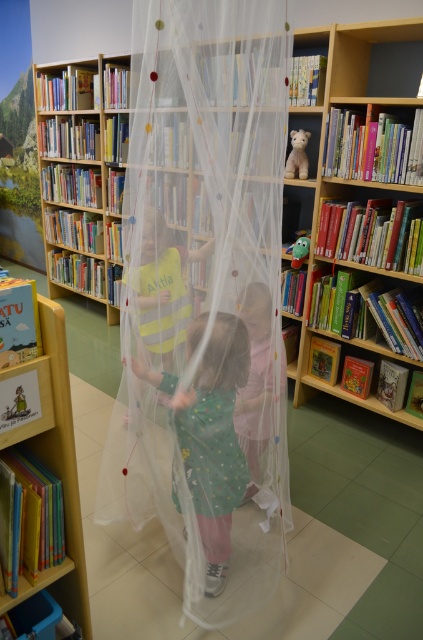
Which of these two, polka dot fabric dress at center or pastel polka dot dress at center, stands taller?

With more height is polka dot fabric dress at center.

This screenshot has width=423, height=640. What are the coordinates of `polka dot fabric dress at center` in the screenshot? It's located at (211, 436).

This screenshot has height=640, width=423. I want to click on polka dot fabric dress at center, so click(x=211, y=436).

Who is shorter, wooden bookshelf at right or green plush toy at upper center?

green plush toy at upper center

Consider the image. Is wooden bookshelf at right to the left of green plush toy at upper center from the viewer's perspective?

No, wooden bookshelf at right is not to the left of green plush toy at upper center.

Does point (400, 416) come in front of point (299, 236)?

Yes, point (400, 416) is in front of point (299, 236).

This screenshot has height=640, width=423. In order to click on wooden bookshelf at right in this screenshot , I will do `click(365, 116)`.

Does polka dot fabric dress at center have a smaller size compared to yellow fabric dress at center?

Incorrect, polka dot fabric dress at center is not smaller in size than yellow fabric dress at center.

Is polka dot fabric dress at center positioned behind yellow fabric dress at center?

That is False.

Between point (249, 356) and point (162, 282), which one is positioned behind?

The point (162, 282) is more distant.

At what (x,y) coordinates should I click in order to perform the action: click on polka dot fabric dress at center. Please return your answer as a coordinate pair (x, y). Image resolution: width=423 pixels, height=640 pixels. Looking at the image, I should click on (211, 436).